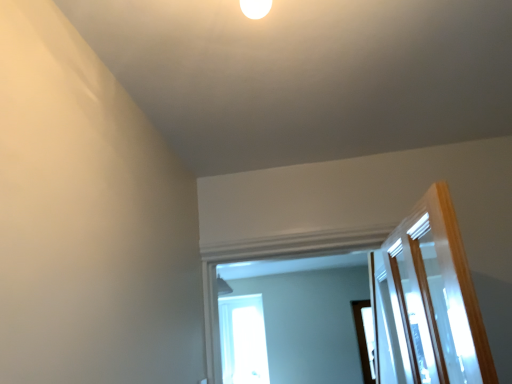
The width and height of the screenshot is (512, 384). In order to click on transparent glass window at center in this screenshot , I will do `click(243, 340)`.

What is the approximate height of transparent glass window at center?

transparent glass window at center is 1.22 meters in height.

Describe the element at coordinates (243, 340) in the screenshot. The width and height of the screenshot is (512, 384). I see `transparent glass window at center` at that location.

The height and width of the screenshot is (384, 512). Identify the location of transparent glass window at center. (243, 340).